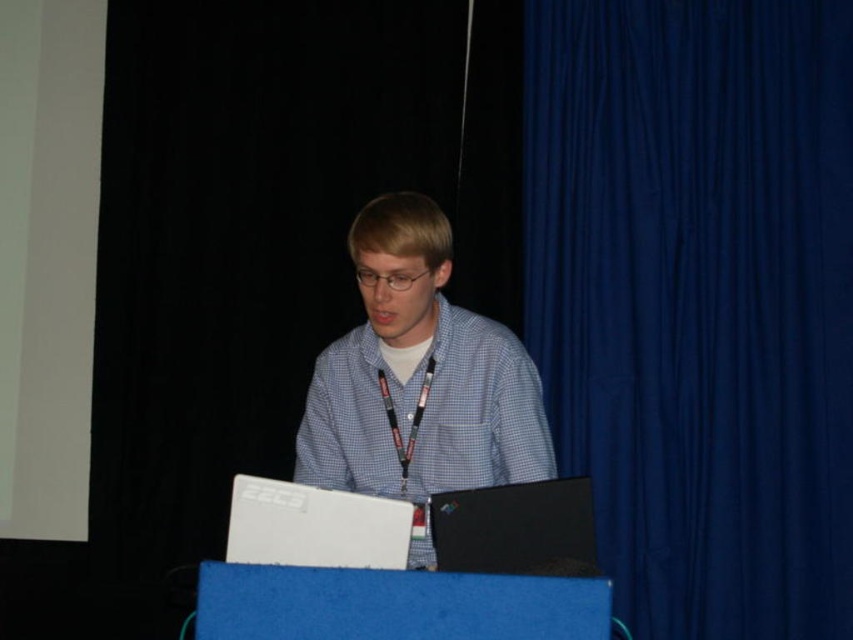
You are standing 5 feet away from the table where the person is sitting. If you want to hand them a document without moving closer than 5 feet, can you reach the matte white shirt at center?

The matte white shirt at center is 6.11 feet away from the viewer. Since you are standing 5 feet away, you can reach it without moving closer than 5 feet.

You are standing at the table where the person is working. You need to place a small object on the table. The first point you consider is point (694,448) and the second is point (544,545). According to the image, which point is further away from you?

Point (694,448) is behind point (544,545), so it is further away from you.

You are a photographer trying to capture a closeup of the person seated at the table. You notice two points marked on the table surface at coordinates point (424, 419) and point (285, 490). Which point should you focus on to ensure the closest possible shot without moving the camera?

Point (424, 419) is further to the camera than point (285, 490). Therefore, focusing on point (424, 419) will allow for a closer shot as it is nearer to the camera position.